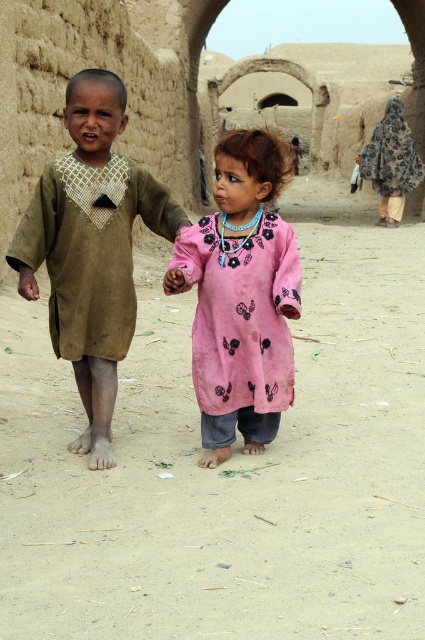
Question: Estimate the real-world distances between objects in this image. Which object is closer to the pink fabric dress at center?

Choices:
 (A) brown suede dress at center
 (B) dusty brown ground at center

Answer: (A)

Question: Is dusty brown ground at center smaller than pink fabric dress at center?

Choices:
 (A) no
 (B) yes

Answer: (A)

Question: Considering the real-world distances, which object is farthest from the brown suede dress at center?

Choices:
 (A) pink fabric dress at center
 (B) floral-patterned fabric at upper right

Answer: (B)

Question: Among these points, which one is nearest to the camera?

Choices:
 (A) (124, 182)
 (B) (192, 276)
 (C) (388, 186)

Answer: (B)

Question: Is dusty brown ground at center further to camera compared to brown suede dress at center?

Choices:
 (A) no
 (B) yes

Answer: (A)

Question: Does pink fabric dress at center appear under floral-patterned fabric at upper right?

Choices:
 (A) yes
 (B) no

Answer: (A)